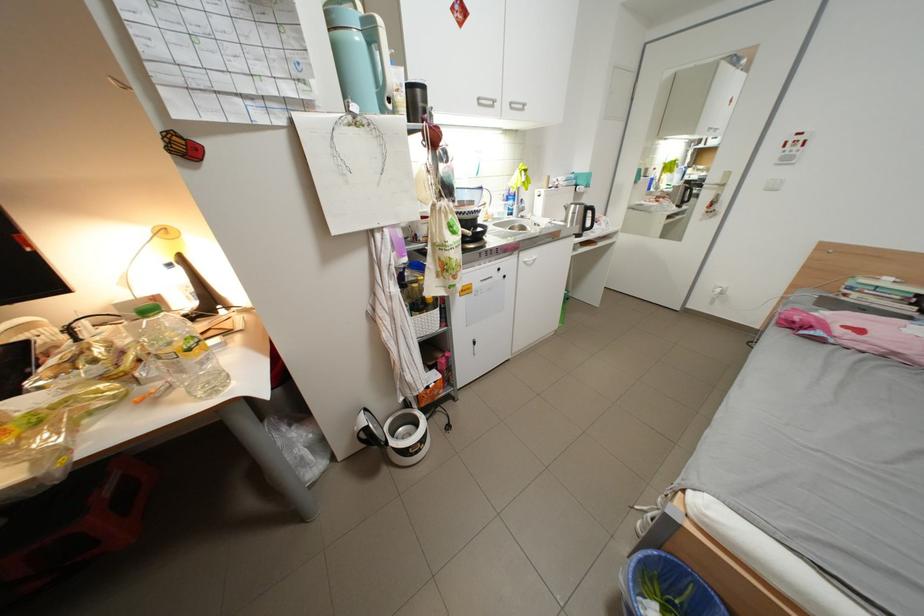
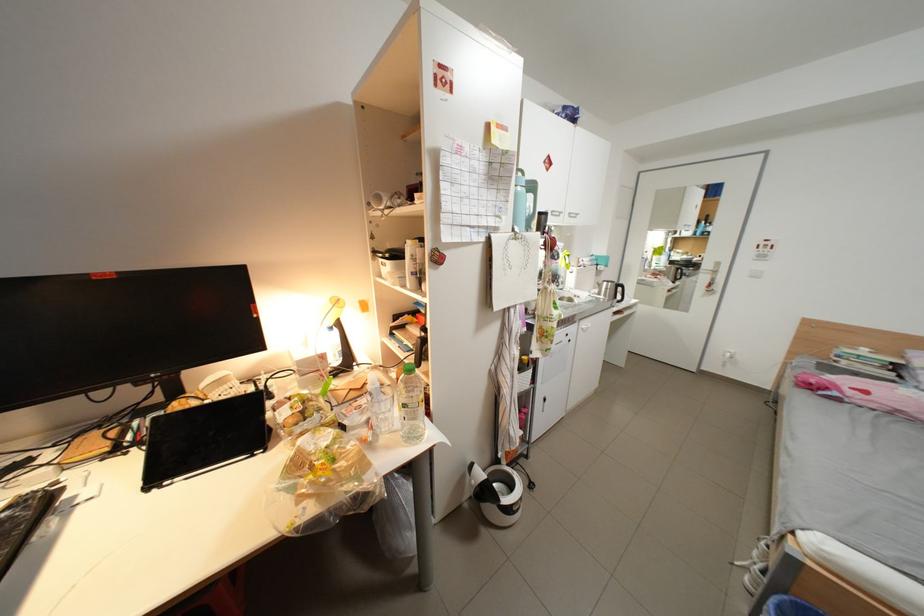
Locate, in the second image, the point that corresponds to (518,264) in the first image.

(582, 331)